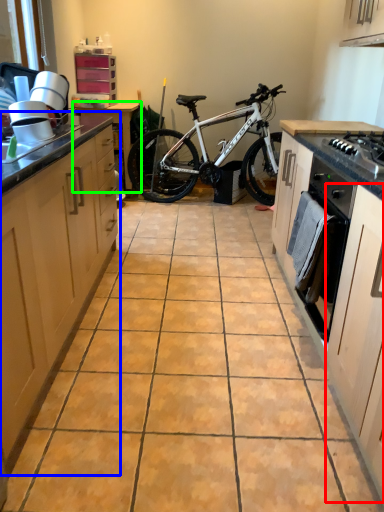
Question: Considering the real-world distances, which object is closest to cabinetry (highlighted by a red box)? cabinetry (highlighted by a blue box) or table (highlighted by a green box).

Choices:
 (A) cabinetry
 (B) table

Answer: (A)